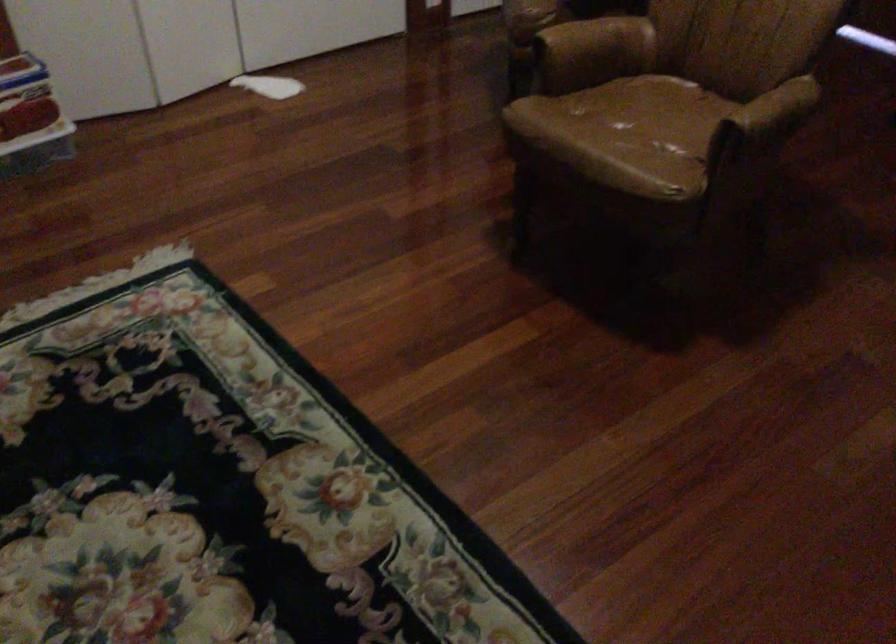
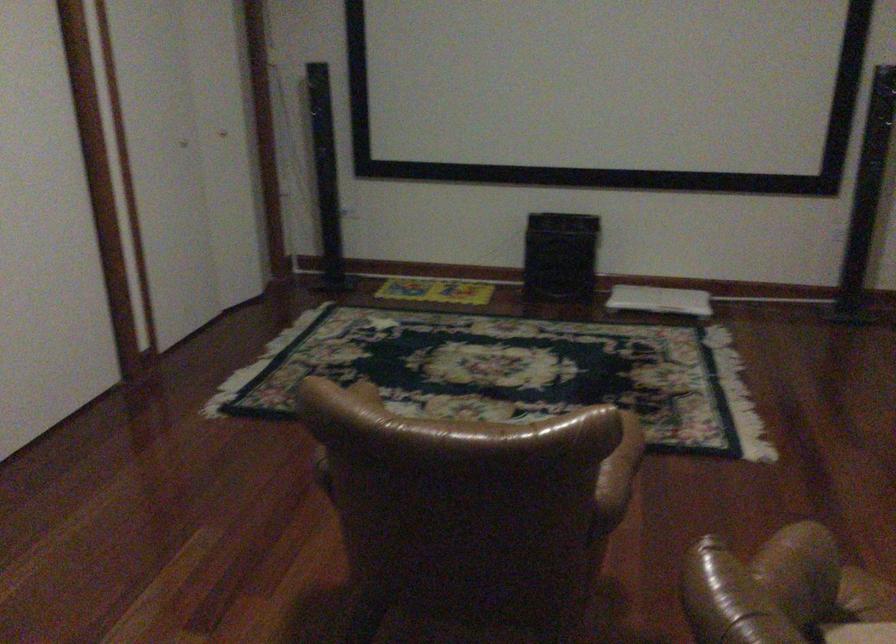
Question: I am providing you with two images of the same scene from different viewpoints. Which of the following objects are not visible in image2?

Choices:
 (A) brown leather armrest
 (B) keyed wall switch
 (C) black speaker box
 (D) brown chair sitting surface

Answer: (D)